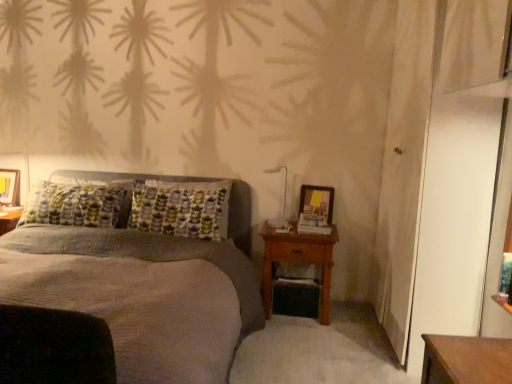
Question: Is wooden nightstand at right taller or shorter than textured gray bed at center?

Choices:
 (A) short
 (B) tall

Answer: (A)

Question: Is wooden nightstand at right situated inside textured gray bed at center or outside?

Choices:
 (A) outside
 (B) inside

Answer: (B)

Question: Estimate the real-world distances between objects in this image. Which object is farther from the matte wooden picture frame at left, placed as the 2th picture frame when sorted from right to left?

Choices:
 (A) matte wooden picture frame at right, which is counted as the second picture frame, starting from the left
 (B) wooden nightstand at right
 (C) textured gray bed at center
 (D) white glossy bedside lamp at upper right

Answer: (A)

Question: Estimate the real-world distances between objects in this image. Which object is closer to the white glossy bedside lamp at upper right?

Choices:
 (A) matte wooden picture frame at left, marked as the first picture frame in a left-to-right arrangement
 (B) matte wooden picture frame at right, the 2th picture frame viewed from the back
 (C) textured gray bed at center
 (D) wooden nightstand at right

Answer: (B)